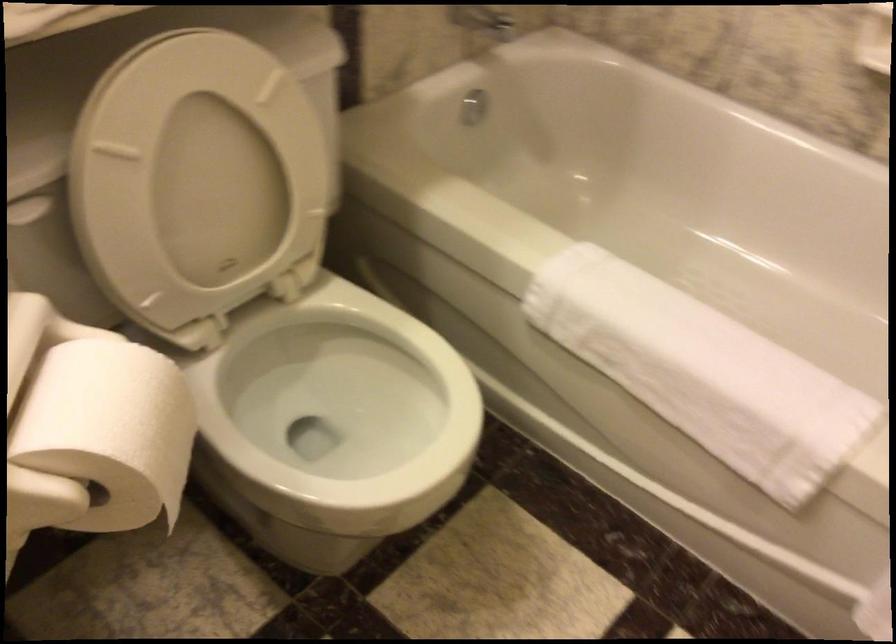
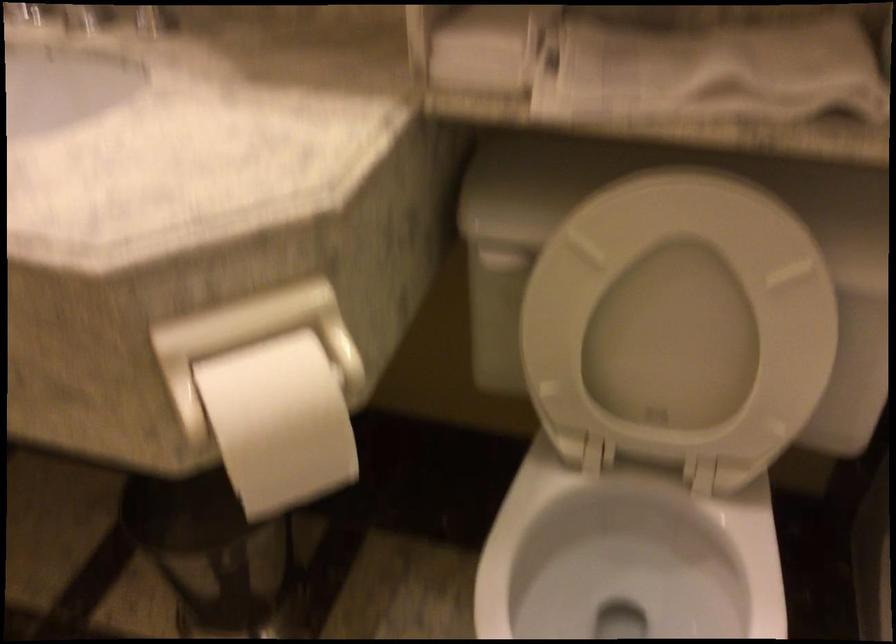
The point at (280,422) is marked in the first image. Where is the corresponding point in the second image?

(609, 574)